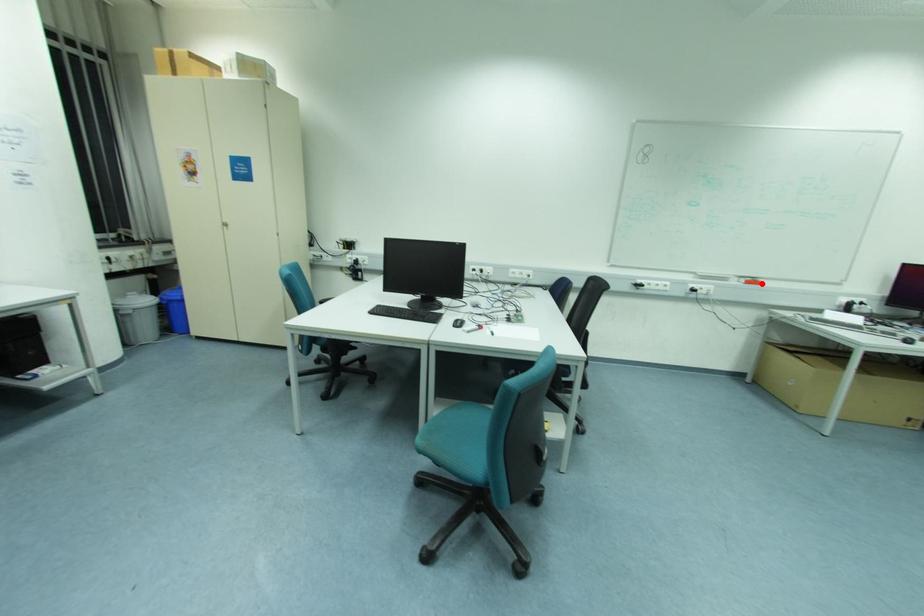
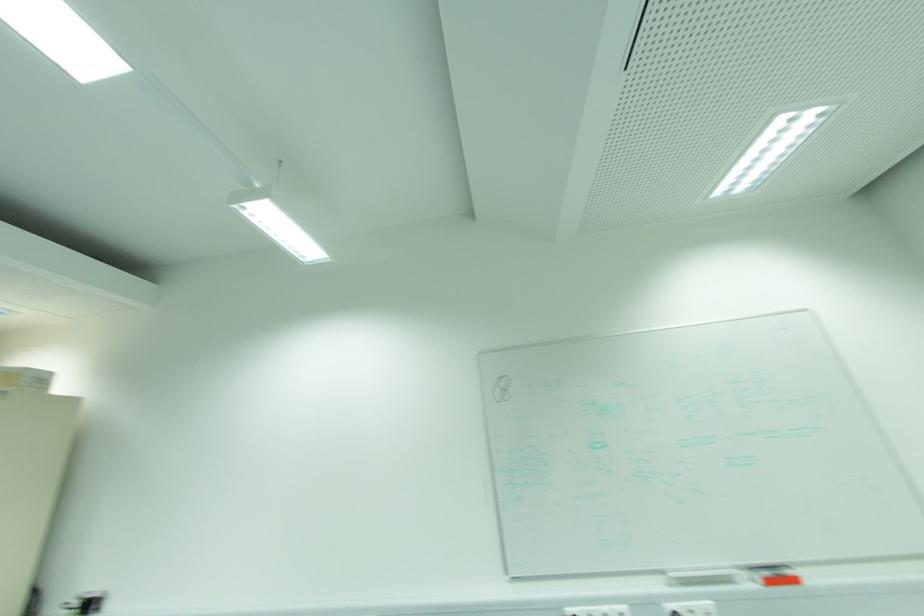
Where in the second image is the point corresponding to the highlighted location from the first image?

(796, 581)